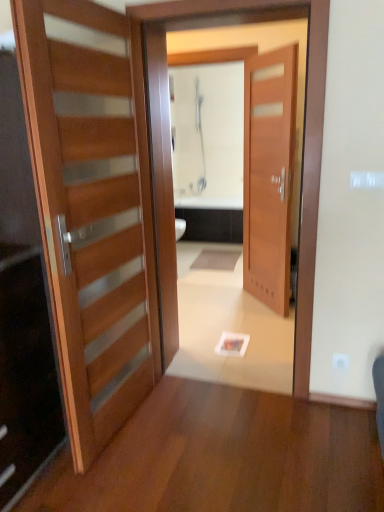
What do you see at coordinates (303, 134) in the screenshot? This screenshot has height=512, width=384. I see `wooden door at center` at bounding box center [303, 134].

Locate an element on the screen. This screenshot has width=384, height=512. wooden door at center, which is the 1th door in back-to-front order is located at coordinates (269, 174).

You are a GUI agent. You are given a task and a screenshot of the screen. Output one action in this format:
    pyautogui.click(x=<x>, y=<y>)
    Task: Click on the wooden door at center
    
    Given the screenshot: What is the action you would take?
    coord(303,134)

Which is closer to the camera, (107, 303) or (249, 10)?

The point (107, 303) is more forward.

From the image's perspective, who appears lower, wooden door at left, which ranks as the 2th door in right-to-left order, or wooden door at center?

wooden door at left, which ranks as the 2th door in right-to-left order.

From a real-world perspective, is wooden door at left, which is the 2th door from back to front, physically located above or below wooden door at center?

wooden door at left, which is the 2th door from back to front, is below wooden door at center.

Are wooden door at left, acting as the 1th door starting from the front, and wooden door at center far apart?

No, wooden door at left, acting as the 1th door starting from the front, is not far from wooden door at center.

Does wooden door at center turn towards wooden door at left, acting as the 1th door starting from the front?

Yes, wooden door at center is oriented towards wooden door at left, acting as the 1th door starting from the front.

Based on their positions, is wooden door at center located to the left or right of wooden door at left, which is the 2th door from back to front?

Clearly, wooden door at center is on the right of wooden door at left, which is the 2th door from back to front, in the image.

Does point (315, 114) appear closer or farther from the camera than point (144, 345)?

Point (315, 114) appears to be closer to the viewer than point (144, 345).

Considering the relative sizes of wooden door at center and wooden door at left, acting as the 1th door starting from the front, in the image provided, is wooden door at center taller than wooden door at left, acting as the 1th door starting from the front,?

Indeed, wooden door at center has a greater height compared to wooden door at left, acting as the 1th door starting from the front.

You are a GUI agent. You are given a task and a screenshot of the screen. Output one action in this format:
    pyautogui.click(x=<x>, y=<y>)
    Task: Click on the door that is on the right side of wooden door at left, which is the 2th door from back to front
    
    Given the screenshot: What is the action you would take?
    pyautogui.click(x=269, y=174)

Does wooden door at left, which is the 2th door from back to front, turn towards wooden door at center, the second door from the front?

No, wooden door at left, which is the 2th door from back to front, is not turned towards wooden door at center, the second door from the front.

Looking at this image, does wooden door at left, which ranks as the 2th door in right-to-left order, have a larger size compared to wooden door at center, the second door from the front?

Correct, wooden door at left, which ranks as the 2th door in right-to-left order, is larger in size than wooden door at center, the second door from the front.

Between wooden door at left, acting as the 1th door starting from the front, and wooden door at center, the second door from the front, which one has less height?

With less height is wooden door at left, acting as the 1th door starting from the front.

The image size is (384, 512). I want to click on door behind the wooden door at center, so click(x=269, y=174).

Is wooden door at center, the second door from the front, next to wooden door at center and touching it?

No, wooden door at center, the second door from the front, is not with wooden door at center.

From a real-world perspective, between wooden door at center, the second door from the front, and wooden door at center, who is vertically lower?

wooden door at center, the second door from the front, is physically lower.

In terms of width, does wooden door at center, the second door from the front, look wider or thinner when compared to wooden door at center?

In the image, wooden door at center, the second door from the front, appears to be more narrow than wooden door at center.

Is wooden door at center, positioned as the 1th door in right-to-left order, wider than wooden door at left, acting as the 1th door starting from the front?

Incorrect, the width of wooden door at center, positioned as the 1th door in right-to-left order, does not surpass that of wooden door at left, acting as the 1th door starting from the front.

Can you confirm if wooden door at center, the second door from the front, is bigger than wooden door at left, which is the 2th door from back to front?

No, wooden door at center, the second door from the front, is not bigger than wooden door at left, which is the 2th door from back to front.

From a real-world perspective, is wooden door at center, which is the 1th door in back-to-front order, beneath wooden door at left, acting as the 1th door starting from the front?

Incorrect, from a real-world perspective, wooden door at center, which is the 1th door in back-to-front order, is higher than wooden door at left, acting as the 1th door starting from the front.

I want to click on door in front of the wooden door at center, the second door from the front, so click(92, 209).

Is wooden door at center facing towards wooden door at center, positioned as the 1th door in right-to-left order?

Yes, wooden door at center is aimed at wooden door at center, positioned as the 1th door in right-to-left order.

Are wooden door at center and wooden door at center, which is the 1th door in back-to-front order, beside each other?

There is a gap between wooden door at center and wooden door at center, which is the 1th door in back-to-front order.

Which of these two, wooden door at center or wooden door at center, acting as the 2th door starting from the left, stands shorter?

wooden door at center, acting as the 2th door starting from the left.

Is wooden door at center inside or outside of wooden door at center, acting as the 2th door starting from the left?

wooden door at center cannot be found inside wooden door at center, acting as the 2th door starting from the left.

At what (x,y) coordinates should I click in order to perform the action: click on door that is the 2nd one below the wooden door at center (from a real-world perspective). Please return your answer as a coordinate pair (x, y). Image resolution: width=384 pixels, height=512 pixels. Looking at the image, I should click on (92, 209).

The image size is (384, 512). What are the coordinates of `screen door behind the wooden door at left, which is the 2th door from back to front` in the screenshot? It's located at (303, 134).

Estimate the real-world distances between objects in this image. Which object is closer to wooden door at left, placed as the 1th door when sorted from left to right, wooden door at center or wooden door at center, the second door from the front?

wooden door at center is closer to wooden door at left, placed as the 1th door when sorted from left to right.

In the scene shown: Estimate the real-world distances between objects in this image. Which object is closer to wooden door at center, wooden door at left, placed as the 1th door when sorted from left to right, or wooden door at center, positioned as the 1th door in right-to-left order?

wooden door at left, placed as the 1th door when sorted from left to right, is closer to wooden door at center.

Based on their spatial positions, is wooden door at center or wooden door at left, which ranks as the 2th door in right-to-left order, closer to wooden door at center, which is the 1th door in back-to-front order?

Among the two, wooden door at center is located nearer to wooden door at center, which is the 1th door in back-to-front order.

Based on their spatial positions, is wooden door at center, the second door from the front, or wooden door at center further from wooden door at left, placed as the 1th door when sorted from left to right?

wooden door at center, the second door from the front.

Estimate the real-world distances between objects in this image. Which object is further from wooden door at center, the second door from the front, wooden door at left, which is the 2th door from back to front, or wooden door at center?

The object further to wooden door at center, the second door from the front, is wooden door at left, which is the 2th door from back to front.

Looking at the image, which one is located further to wooden door at center, wooden door at center, which is the 1th door in back-to-front order, or wooden door at left, which is the 2th door from back to front?

Based on the image, wooden door at center, which is the 1th door in back-to-front order, appears to be further to wooden door at center.

Where is `screen door between wooden door at left, placed as the 1th door when sorted from left to right, and wooden door at center, acting as the 2th door starting from the left, from front to back`? This screenshot has height=512, width=384. screen door between wooden door at left, placed as the 1th door when sorted from left to right, and wooden door at center, acting as the 2th door starting from the left, from front to back is located at coordinates (303, 134).